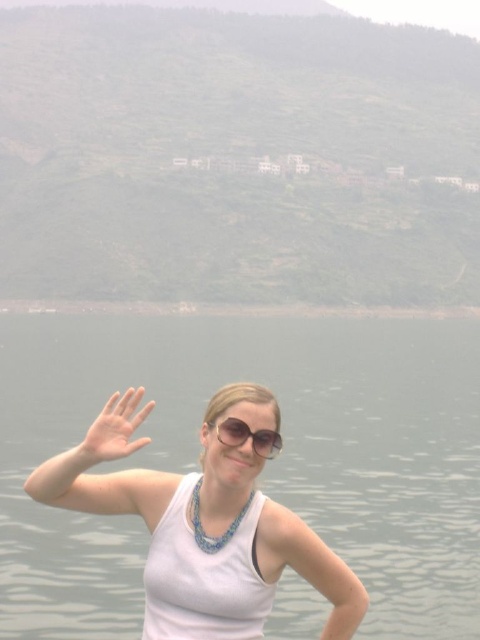
Question: In this image, where is smooth flesh hand at lower left located relative to sunglasses at center?

Choices:
 (A) left
 (B) right

Answer: (A)

Question: Which is nearer to the pale skin flesh at left?

Choices:
 (A) smooth flesh hand at lower left
 (B) white fabric at center
 (C) sunglasses at center

Answer: (B)

Question: Which point appears closest to the camera in this image?

Choices:
 (A) (160, 493)
 (B) (110, 428)
 (C) (268, 444)

Answer: (B)

Question: Is white fabric at center wider than sunglasses at center?

Choices:
 (A) yes
 (B) no

Answer: (A)

Question: Can you confirm if white fabric at center is positioned to the right of pale skin flesh at left?

Choices:
 (A) no
 (B) yes

Answer: (B)

Question: Which object is positioned closest to the smooth flesh hand at lower left?

Choices:
 (A) sunglasses at center
 (B) white fabric at center

Answer: (A)